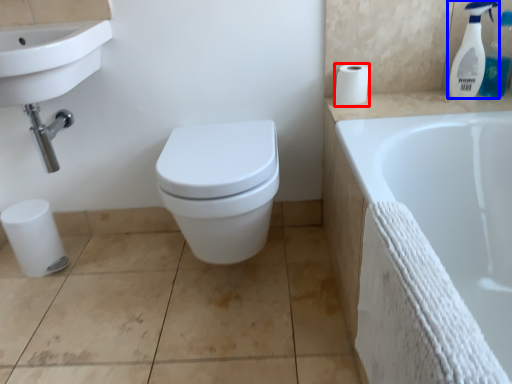
Question: Which object appears farthest to the camera in this image, toilet paper (highlighted by a red box) or cleaning product (highlighted by a blue box)?

Choices:
 (A) toilet paper
 (B) cleaning product

Answer: (A)